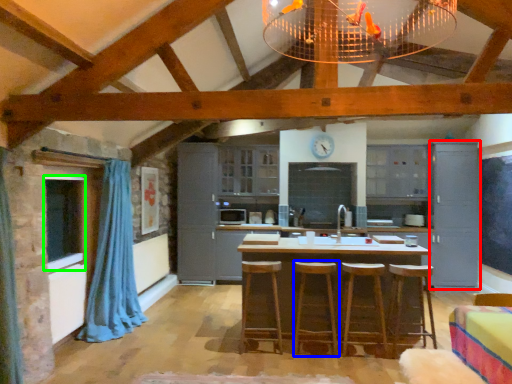
Question: Based on their relative distances, which object is farther from cabinetry (highlighted by a red box)? Choose from bar stool (highlighted by a blue box) and window (highlighted by a green box).

Choices:
 (A) bar stool
 (B) window

Answer: (B)